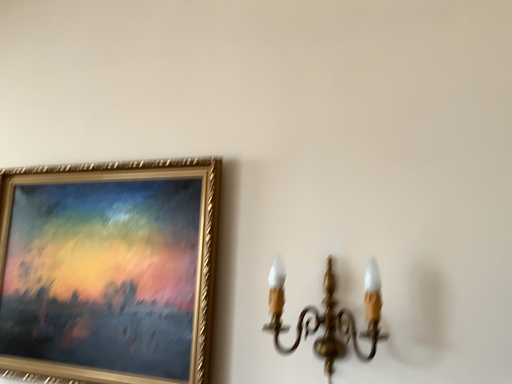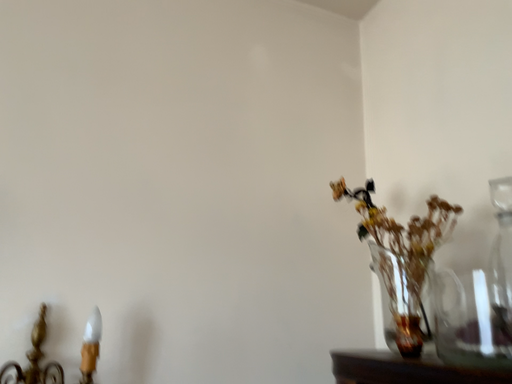
Question: Which way did the camera rotate in the video?

Choices:
 (A) rotated right
 (B) rotated left

Answer: (A)